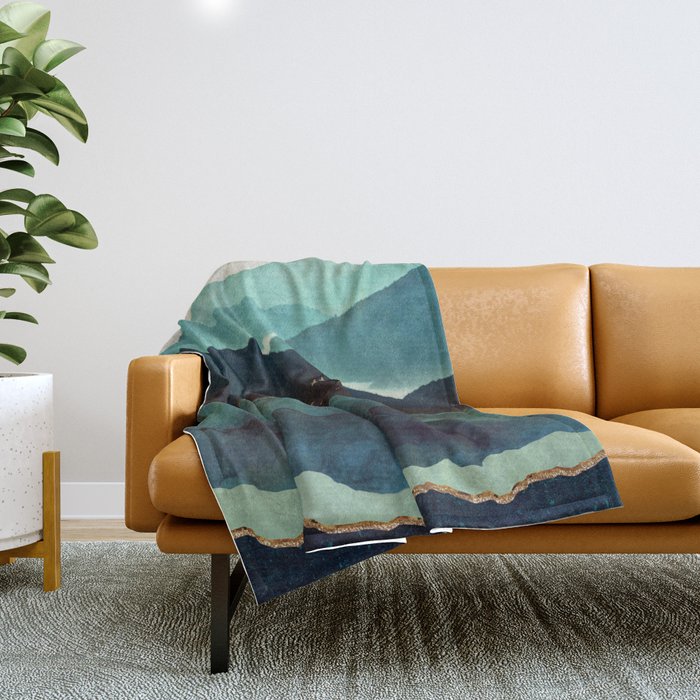
At what (x,y) coordinates should I click in order to perform the action: click on rug. Please return your answer as a coordinate pair (x, y). The width and height of the screenshot is (700, 700). Looking at the image, I should click on (106, 626).